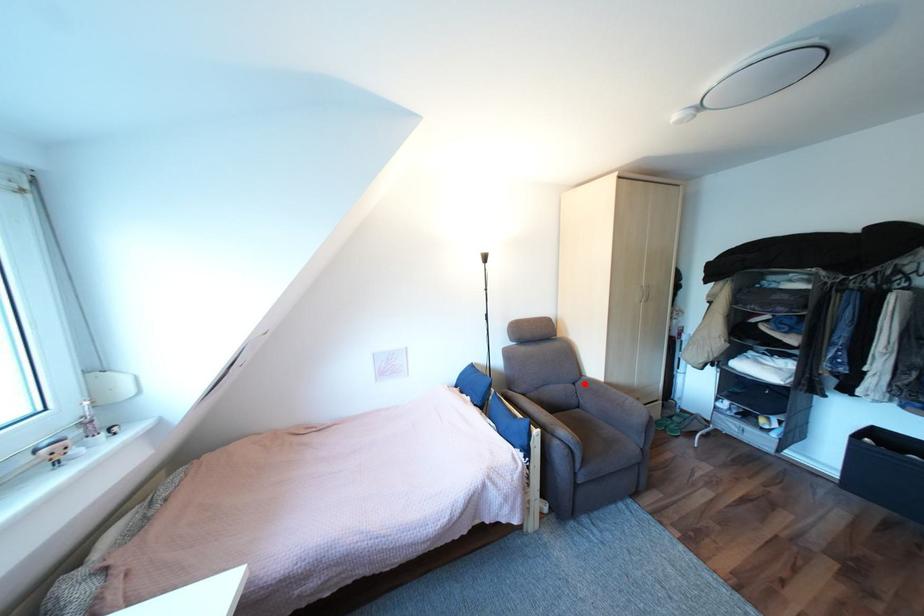
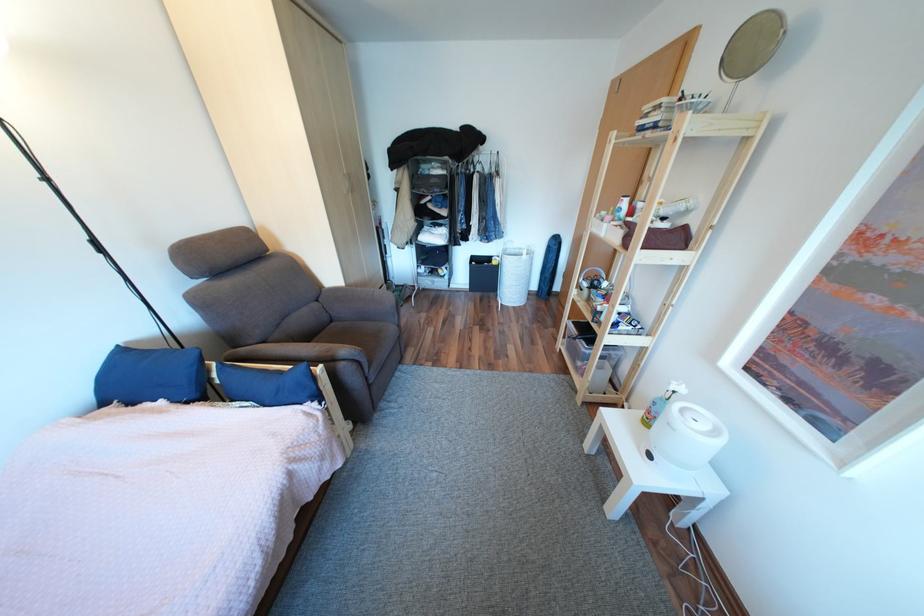
In the second image, find the point that corresponds to the highlighted location in the first image.

(329, 301)